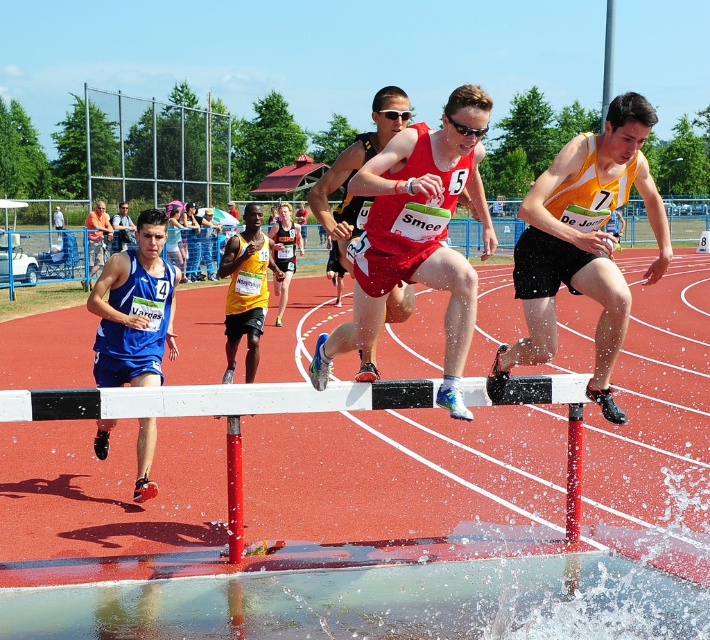
Question: Which point is closer to the camera?

Choices:
 (A) white plastic hurdle at center
 (B) yellow mesh tank top at center

Answer: (A)

Question: Does yellow mesh tank top at center lie in front of blue fabric shirt at center?

Choices:
 (A) no
 (B) yes

Answer: (B)

Question: Does white plastic hurdle at center appear on the left side of matte red bib at center?

Choices:
 (A) no
 (B) yes

Answer: (A)

Question: Among these objects, which one is nearest to the camera?

Choices:
 (A) white plastic hurdle at center
 (B) yellow mesh tank top at center
 (C) blue fabric shorts at left

Answer: (A)

Question: Which point appears farthest from the camera in this image?

Choices:
 (A) (246, 225)
 (B) (405, 308)
 (C) (547, 381)

Answer: (A)

Question: Does orange/black athletic uniform at right appear under blue fabric shirt at center?

Choices:
 (A) yes
 (B) no

Answer: (A)